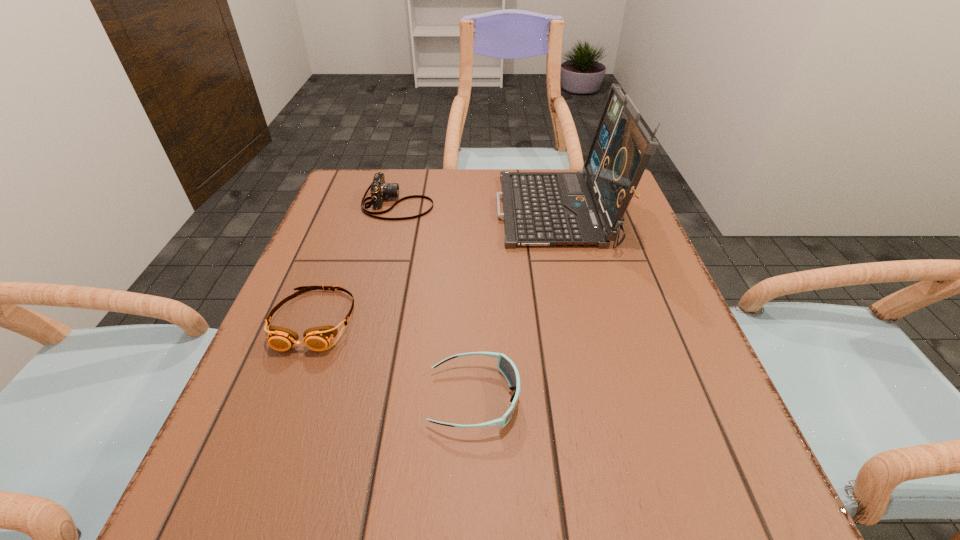
Find the location of `free space at the near edge`. free space at the near edge is located at coordinates (339, 525).

This screenshot has width=960, height=540. I want to click on free region at the left edge of the desktop, so click(x=338, y=377).

Locate an element on the screen. This screenshot has height=540, width=960. free space at the right edge of the desktop is located at coordinates (627, 277).

In the image, there is a desktop. Where is `free space at the far left corner`? free space at the far left corner is located at coordinates (370, 192).

Locate an element on the screen. vacant space at the near right corner of the desktop is located at coordinates (698, 485).

Identify the location of vacant space that's between the farther goggles and the camera. The height and width of the screenshot is (540, 960). (356, 262).

At what (x,y) coordinates should I click in order to perform the action: click on vacant space in between the camera and the tallest object. Please return your answer as a coordinate pair (x, y). Looking at the image, I should click on (478, 208).

Locate an element on the screen. The height and width of the screenshot is (540, 960). free spot between the third farthest object and the camera is located at coordinates [356, 262].

Identify the location of vacant space that's between the nearest object and the camera. This screenshot has width=960, height=540. (436, 301).

I want to click on empty space that is in between the laptop computer and the camera, so click(478, 208).